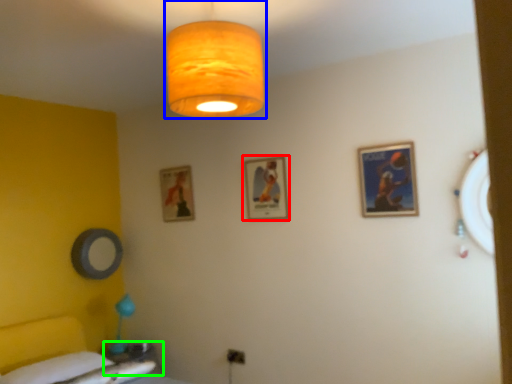
Question: Estimate the real-world distances between objects in this image. Which object is farther from picture frame (highlighted by a red box), lamp (highlighted by a blue box) or table (highlighted by a green box)?

Choices:
 (A) lamp
 (B) table

Answer: (B)